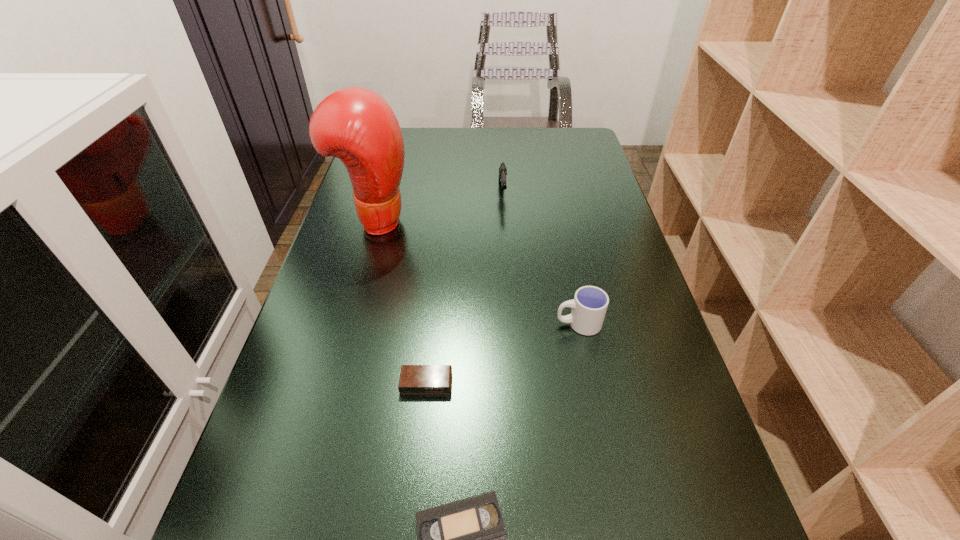
I want to click on vacant region located 0.270m with the handle on the side of the cup, so click(x=427, y=323).

You are a GUI agent. You are given a task and a screenshot of the screen. Output one action in this format:
    pyautogui.click(x=<x>, y=<y>)
    Task: Click on the free spot located 0.260m with the handle on the side of the cup
    
    Given the screenshot: What is the action you would take?
    pyautogui.click(x=432, y=323)

Locate an element on the screen. This screenshot has width=960, height=540. vacant region located on the front face of the fourth tallest object is located at coordinates (416, 491).

Find the location of a particular element. The width and height of the screenshot is (960, 540). object that is at the left edge is located at coordinates (355, 124).

Where is `object that is at the right edge`? object that is at the right edge is located at coordinates (589, 306).

Identify the location of free space at the far edge. (473, 127).

In the image, there is a desktop. Identify the location of vacant region at the left edge. (372, 265).

You are a GUI agent. You are given a task and a screenshot of the screen. Output one action in this format:
    pyautogui.click(x=<x>, y=<y>)
    Task: Click on the vacant area at the right edge of the desktop
    This screenshot has width=960, height=540.
    Given the screenshot: What is the action you would take?
    pyautogui.click(x=645, y=448)

I want to click on blank area at the far right corner, so click(x=563, y=135).

Locate an element on the screen. The height and width of the screenshot is (540, 960). vacant space that is in between the cup and the second shortest object is located at coordinates (502, 353).